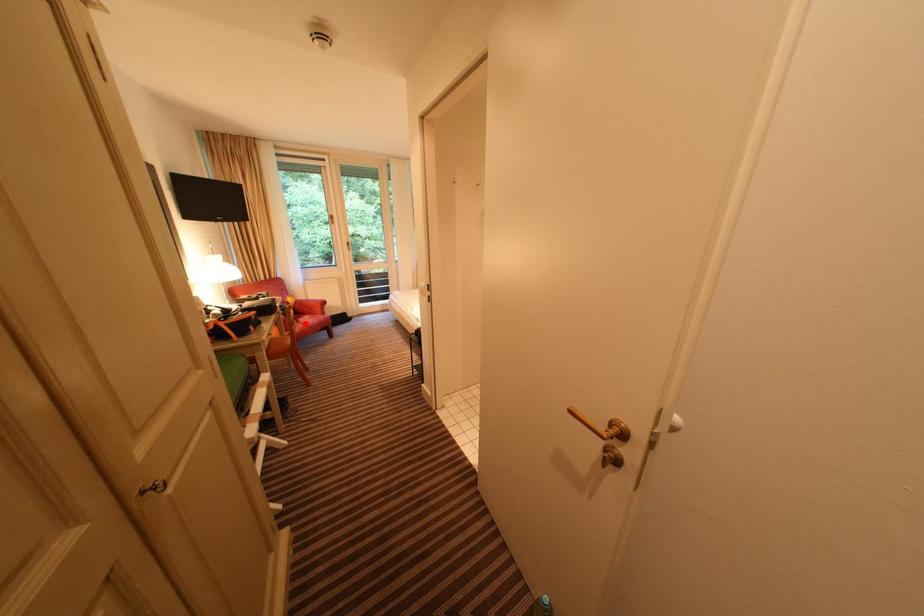
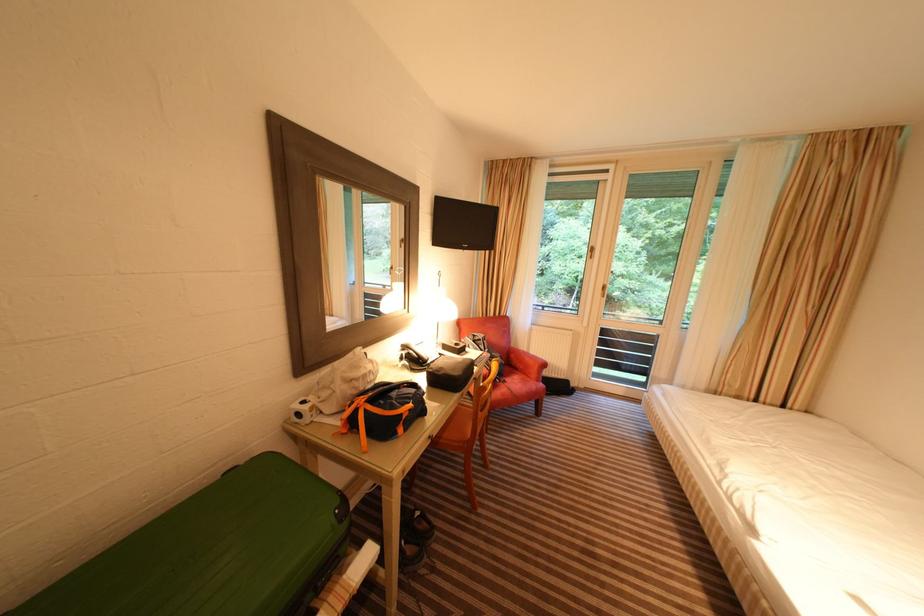
Locate, in the second image, the point that corresponds to the highlighted location in the first image.

(512, 384)